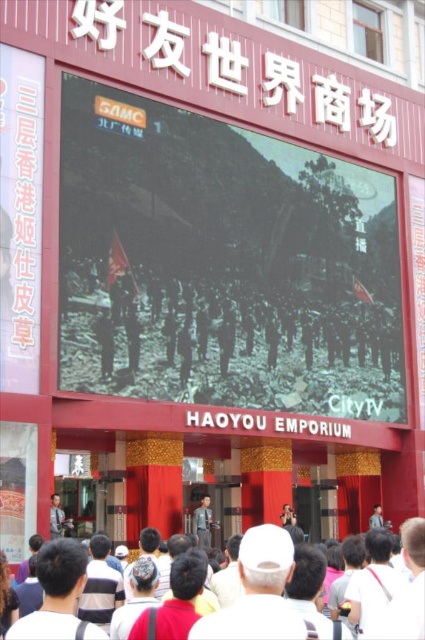
You are standing at the entrance of HAOYOU EMPORIUM and want to hang a decorative banner between the black matte screen at center and the light brown leather jacket at lower left. Which object should the banner be placed closer to if you want it to be closer to the left side of the entrance?

The light brown leather jacket at lower left is on the left side of the black matte screen at center. Therefore, placing the banner closer to the light brown leather jacket at lower left would position it nearer to the left side of the entrance.

You are standing at the entrance of HAOYOU EMPORIUM and looking at the digital screen above. There are two points marked on the screen at coordinates point (138, 193) and point (56, 518). Which point is closer to you?

Point (138, 193) is closer to the camera than point (56, 518), so the point closer to you is point (138, 193).